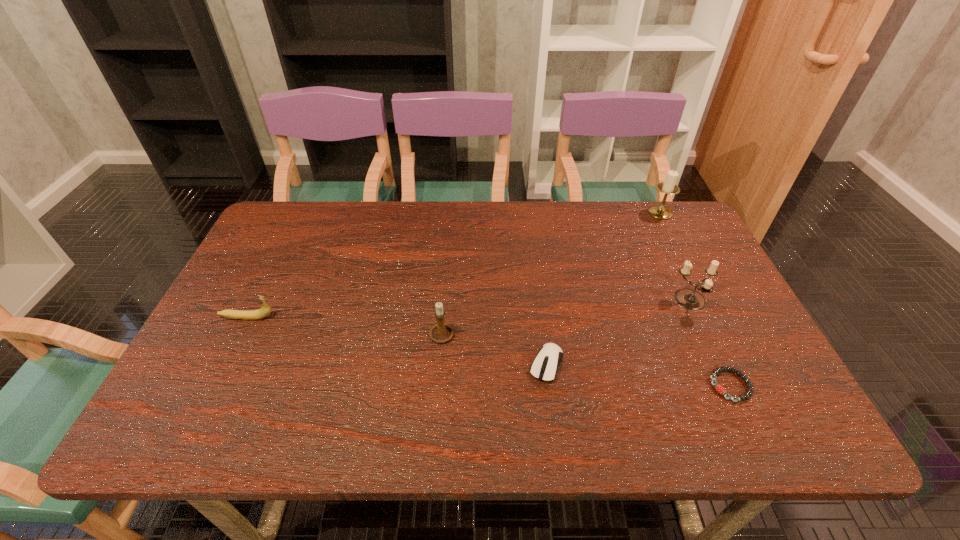
In order to click on object present at the far right corner in this screenshot , I will do `click(668, 187)`.

The width and height of the screenshot is (960, 540). What are the coordinates of `object situated at the near right corner` in the screenshot? It's located at (719, 388).

Find the location of `blank space at the far edge of the desktop`. blank space at the far edge of the desktop is located at coordinates (350, 237).

The image size is (960, 540). Identify the location of free space at the near edge. (690, 425).

You are a GUI agent. You are given a task and a screenshot of the screen. Output one action in this format:
    pyautogui.click(x=<x>, y=<y>)
    Task: Click on the free space at the left edge of the desktop
    This screenshot has width=960, height=540.
    Given the screenshot: What is the action you would take?
    pyautogui.click(x=219, y=315)

Where is `free space at the right edge of the desktop`? This screenshot has height=540, width=960. free space at the right edge of the desktop is located at coordinates click(x=761, y=356).

This screenshot has width=960, height=540. In the image, there is a desktop. What are the coordinates of `free space at the far right corner` in the screenshot? It's located at (679, 231).

This screenshot has height=540, width=960. In order to click on vacant region between the bracelet and the mouse in this screenshot , I will do `click(638, 375)`.

Locate an element on the screen. unoccupied position between the third shortest object and the mouse is located at coordinates (396, 341).

Locate an element on the screen. The height and width of the screenshot is (540, 960). free space between the shortest object and the banana is located at coordinates (489, 352).